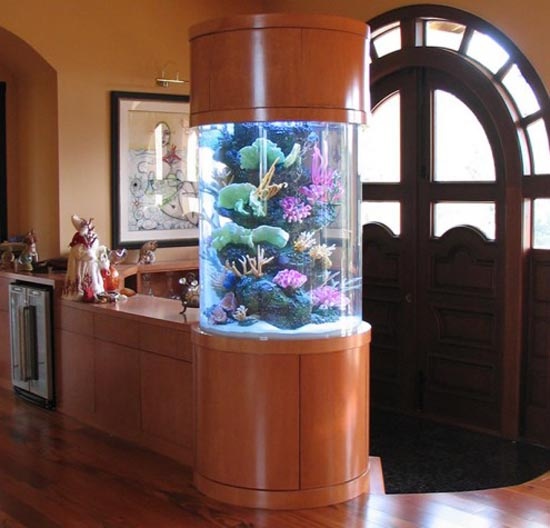
In order to click on rug in this screenshot , I will do `click(449, 441)`.